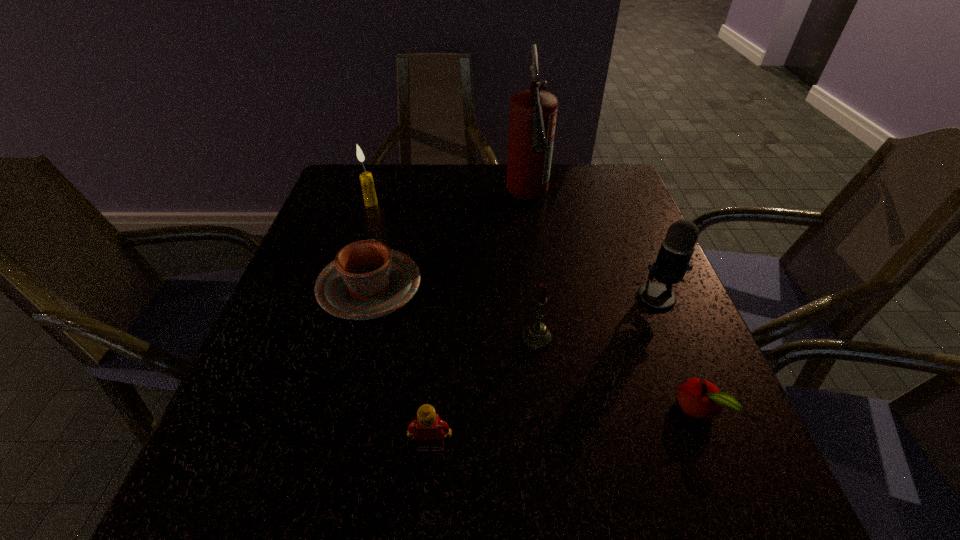
Identify the location of apple. This screenshot has height=540, width=960. (700, 399).

You are a GUI agent. You are given a task and a screenshot of the screen. Output one action in this format:
    pyautogui.click(x=<x>, y=<y>)
    Task: Click on the free location located 0.070m at the nozzle of the tallest object
    Image resolution: width=960 pixels, height=540 pixels.
    Given the screenshot: What is the action you would take?
    pyautogui.click(x=534, y=248)

Where is `vacant region located on the left of the microphone`? vacant region located on the left of the microphone is located at coordinates (566, 297).

The width and height of the screenshot is (960, 540). Identify the location of vacant space located 0.050m on the right of the farther candle. (396, 204).

This screenshot has width=960, height=540. In order to click on vacant space located 0.160m on the front of the right candle in this screenshot , I will do `click(547, 429)`.

Identify the location of blank space located 0.110m on the handle side of the second shortest object. (386, 226).

You are a GUI agent. You are given a task and a screenshot of the screen. Output one action in this format:
    pyautogui.click(x=<x>, y=<y>)
    Task: Click on the free space located 0.080m on the handle side of the second shortest object
    
    Given the screenshot: What is the action you would take?
    pyautogui.click(x=384, y=234)

Find the location of a particular element. The height and width of the screenshot is (540, 960). vacant area located on the handle side of the second shortest object is located at coordinates (388, 219).

I want to click on vacant space situated 0.320m on the back of the shortest object, so click(x=641, y=267).

The image size is (960, 540). I want to click on fire extinguisher that is positioned at the far edge, so click(x=533, y=113).